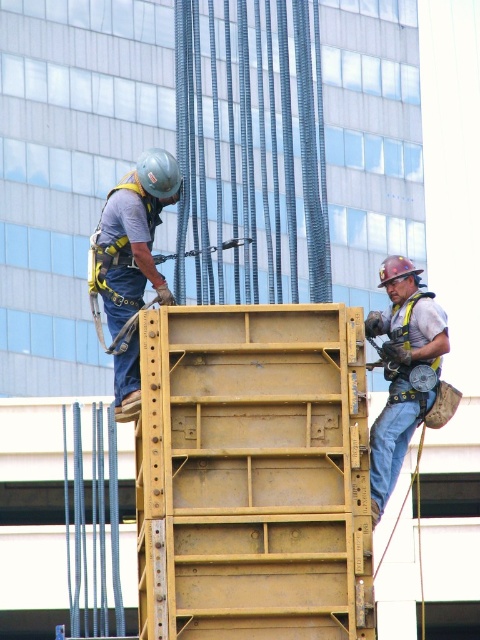
The image size is (480, 640). Describe the element at coordinates (132, 237) in the screenshot. I see `matte gray helmet at upper left` at that location.

Is matte gray helmet at upper left to the right of matte yellow safety harness at right from the viewer's perspective?

No, matte gray helmet at upper left is not to the right of matte yellow safety harness at right.

Does point (112, 234) come farther from viewer compared to point (368, 333)?

That is True.

The image size is (480, 640). I want to click on matte gray helmet at upper left, so click(132, 237).

Is yellow metallic frame at center wider than matte gray helmet at upper left?

Incorrect, yellow metallic frame at center's width does not surpass matte gray helmet at upper left's.

Is yellow metallic frame at center positioned in front of matte gray helmet at upper left?

Yes.

This screenshot has width=480, height=640. In order to click on yellow metallic frame at center in this screenshot , I will do `click(252, 476)`.

Measure the distance from yellow metallic frame at center to matte yellow safety harness at right.

They are 7.97 meters apart.

Which is behind, point (275, 497) or point (409, 316)?

The point (409, 316) is behind.

Who is more distant from viewer, (253, 352) or (436, 355)?

The point (436, 355) is more distant.

Locate an element on the screen. yellow metallic frame at center is located at coordinates [x=252, y=476].